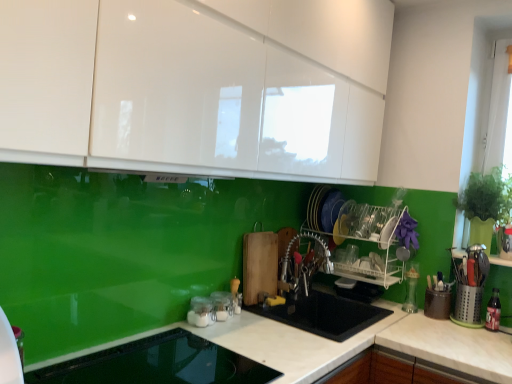
I want to click on free space to the left of clear glass jars at lower center, the second appliance in the left-to-right sequence, so (x=165, y=327).